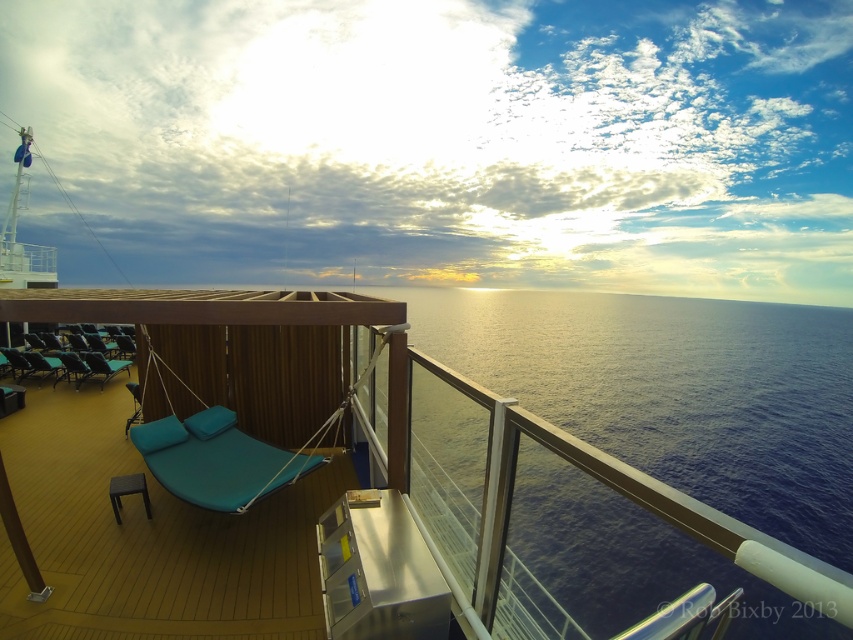
Between teal fabric daybed at center and teal fabric lounge chair at center, which one has more height?

With more height is teal fabric lounge chair at center.

Can you confirm if teal fabric daybed at center is positioned to the right of teal fabric lounge chair at center?

Indeed, teal fabric daybed at center is positioned on the right side of teal fabric lounge chair at center.

This screenshot has height=640, width=853. What do you see at coordinates (216, 460) in the screenshot?
I see `teal fabric daybed at center` at bounding box center [216, 460].

In order to click on teal fabric daybed at center in this screenshot , I will do `click(216, 460)`.

Who is more distant from viewer, (723, 346) or (219, 488)?

The point (723, 346) is behind.

Who is taller, blue water at center or teal fabric daybed at center?

blue water at center

I want to click on blue water at center, so click(674, 390).

Is blue water at center thinner than teal fabric lounge chair at center?

No, blue water at center is not thinner than teal fabric lounge chair at center.

Between blue water at center and teal fabric lounge chair at center, which one has less height?

Standing shorter between the two is teal fabric lounge chair at center.

What are the coordinates of `blue water at center` in the screenshot? It's located at (674, 390).

This screenshot has width=853, height=640. I want to click on blue water at center, so click(x=674, y=390).